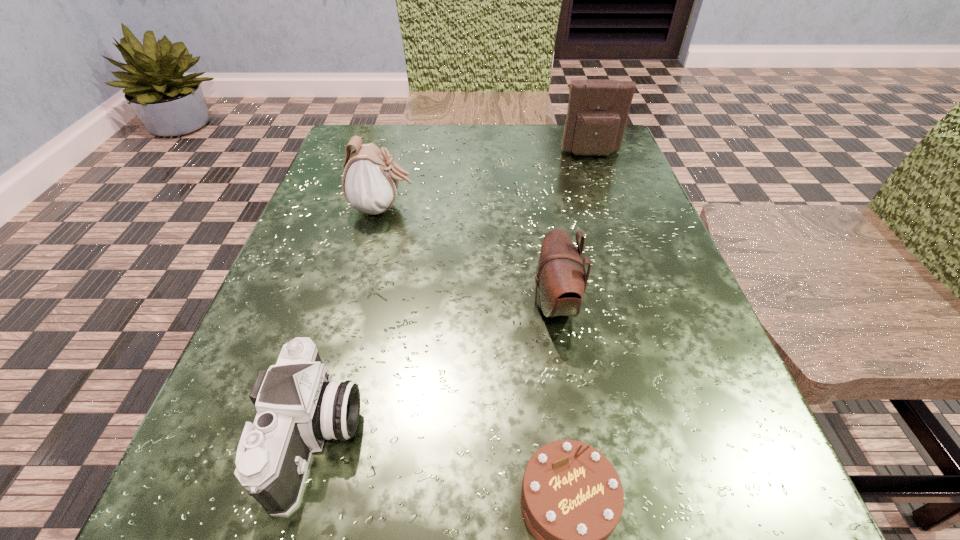
Where is `vacant point located between the shortest pouch and the second farthest object`? This screenshot has width=960, height=540. vacant point located between the shortest pouch and the second farthest object is located at coordinates (469, 256).

Where is `object that can be found as the closest to the shortest pouch`? This screenshot has width=960, height=540. object that can be found as the closest to the shortest pouch is located at coordinates coord(572,498).

Select which object appears as the closest to the chocolate cake. Please provide its 2D coordinates. Your answer should be formatted as a tuple, i.e. [(x, y)], where the tuple contains the x and y coordinates of a point satisfying the conditions above.

[(561, 281)]

Point out which pouch is positioned as the second nearest to the camera. Please provide its 2D coordinates. Your answer should be formatted as a tuple, i.e. [(x, y)], where the tuple contains the x and y coordinates of a point satisfying the conditions above.

[(370, 181)]

Locate which pouch ranks second in proximity to the leftmost pouch. Please provide its 2D coordinates. Your answer should be formatted as a tuple, i.e. [(x, y)], where the tuple contains the x and y coordinates of a point satisfying the conditions above.

[(597, 114)]

Where is `free point that satisfies the following two spatial constraints: 1. with an open flap on the rightmost object; 2. with the flap open on the third farthest object`? This screenshot has height=540, width=960. free point that satisfies the following two spatial constraints: 1. with an open flap on the rightmost object; 2. with the flap open on the third farthest object is located at coordinates (643, 303).

Where is `free space that satisfies the following two spatial constraints: 1. with an open flap on the farthest pouch; 2. with the flap open on the shortest pouch`? This screenshot has height=540, width=960. free space that satisfies the following two spatial constraints: 1. with an open flap on the farthest pouch; 2. with the flap open on the shortest pouch is located at coordinates (643, 303).

This screenshot has width=960, height=540. What are the coordinates of `free spot that satisfies the following two spatial constraints: 1. with an open flap on the rightmost pouch; 2. on the front-facing side of the fourth nearest object` in the screenshot? It's located at (611, 208).

Locate an element on the screen. free spot that satisfies the following two spatial constraints: 1. with an open flap on the rightmost object; 2. on the front-facing side of the second nearest pouch is located at coordinates (611, 208).